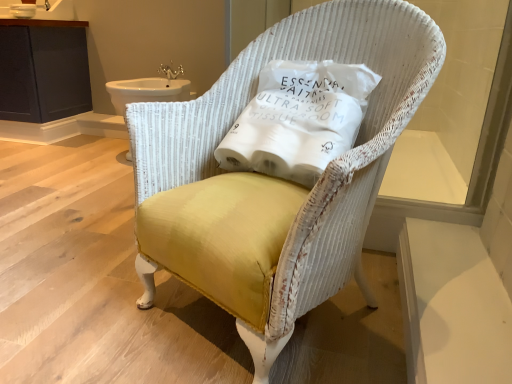
Question: Is yellow fabric chair at center inside or outside of dark gray wood cabinet at upper left?

Choices:
 (A) inside
 (B) outside

Answer: (B)

Question: Considering their positions, is yellow fabric chair at center located in front of or behind dark gray wood cabinet at upper left?

Choices:
 (A) behind
 (B) front

Answer: (B)

Question: Considering the real-world distances, which object is closest to the yellow fabric chair at center?

Choices:
 (A) dark gray wood cabinet at upper left
 (B) gold metallic faucet at upper center
 (C) white fabric pillow at center
 (D) white ceramic sink at upper left

Answer: (C)

Question: Estimate the real-world distances between objects in this image. Which object is closer to the white fabric pillow at center?

Choices:
 (A) dark gray wood cabinet at upper left
 (B) yellow fabric chair at center
 (C) white ceramic sink at upper left
 (D) gold metallic faucet at upper center

Answer: (B)